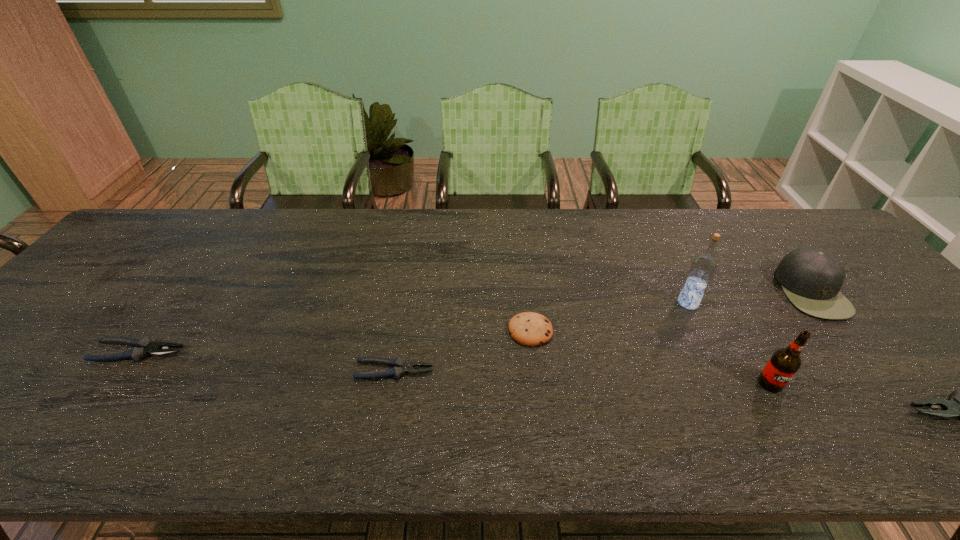
Find the location of a particular element. This screenshot has width=960, height=540. vacant area that lies between the second shortest object and the vodka is located at coordinates (414, 328).

Identify the location of empty location between the second shortest pliers and the cap. (475, 321).

Locate an element on the screen. The height and width of the screenshot is (540, 960). free space between the second pliers from right to left and the cap is located at coordinates pos(603,331).

I want to click on vacant space that's between the third object from left to right and the sixth object from right to left, so click(463, 351).

Select which object appears as the sixth closest to the fourth object from right to left. Please provide its 2D coordinates. Your answer should be formatted as a tuple, i.e. [(x, y)], where the tuple contains the x and y coordinates of a point satisfying the conditions above.

[(143, 347)]

The width and height of the screenshot is (960, 540). Find the location of `the third closest object to the tallest object`. the third closest object to the tallest object is located at coordinates (530, 329).

Locate which pliers ranks second in proximity to the nearest pliers. Please provide its 2D coordinates. Your answer should be formatted as a tuple, i.e. [(x, y)], where the tuple contains the x and y coordinates of a point satisfying the conditions above.

[(143, 347)]

Locate an element on the screen. Image resolution: width=960 pixels, height=540 pixels. the third closest pliers to the fourth object from right to left is located at coordinates (143, 347).

This screenshot has width=960, height=540. I want to click on vacant area that satisfies the following two spatial constraints: 1. on the front side of the fifth object from right to left; 2. at the gripping part of the second shortest object, so click(x=533, y=352).

Locate an element on the screen. The width and height of the screenshot is (960, 540). free region that satisfies the following two spatial constraints: 1. on the front side of the cookie; 2. at the gripping part of the shortest object is located at coordinates (535, 370).